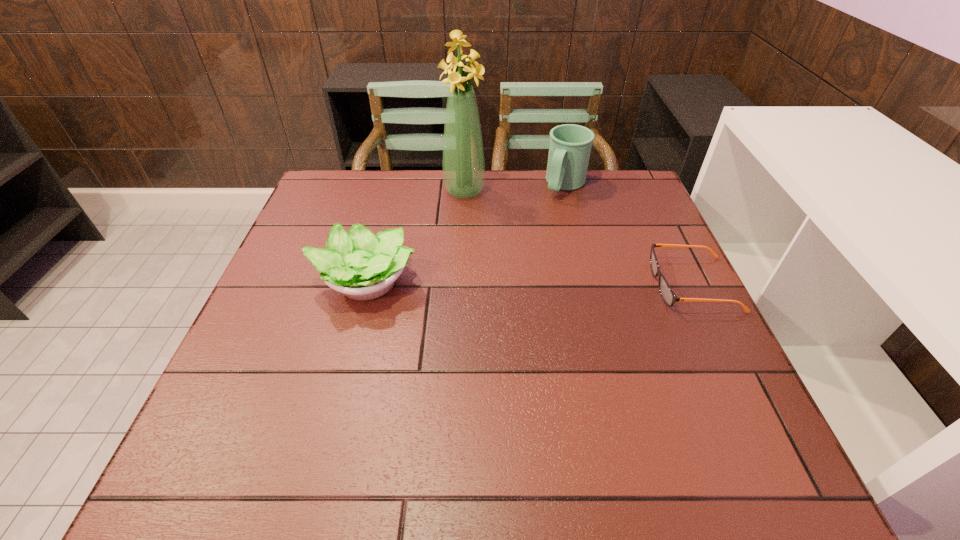
The image size is (960, 540). I want to click on free space between the spectacles and the second object from right to left, so click(x=629, y=235).

The width and height of the screenshot is (960, 540). In order to click on unoccupied area between the third tallest object and the rightmost object in this screenshot , I will do `click(529, 283)`.

Identify the location of vacant space that is in between the leftmost object and the rightmost object. Image resolution: width=960 pixels, height=540 pixels. (529, 283).

In order to click on vacant region between the third shortest object and the bouquet in this screenshot , I will do `click(515, 188)`.

I want to click on free space between the second tallest object and the rightmost object, so click(629, 235).

What are the coordinates of `empty space that is in between the mug and the third tallest object` in the screenshot? It's located at (466, 234).

Find the location of a particular element. blank region between the spectacles and the third tallest object is located at coordinates (529, 283).

Where is `unoccupied position between the bouquet and the lettuce`? The image size is (960, 540). unoccupied position between the bouquet and the lettuce is located at coordinates (416, 237).

The width and height of the screenshot is (960, 540). Find the location of `the third closest object to the third tallest object`. the third closest object to the third tallest object is located at coordinates (669, 297).

The width and height of the screenshot is (960, 540). Identify the location of object that stands as the closest to the mug. (463, 163).